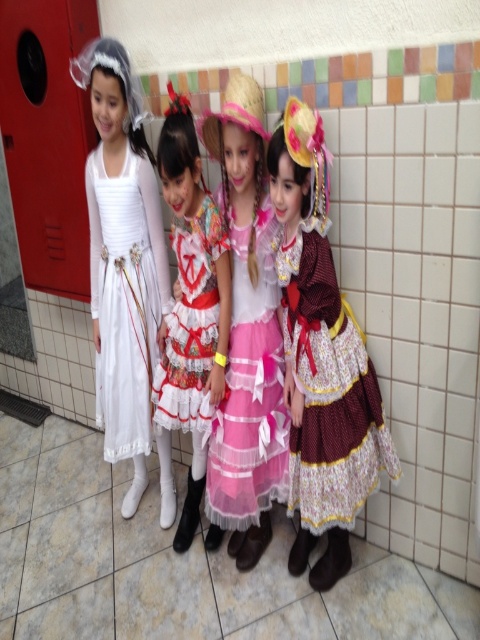
Question: Among these points, which one is farthest from the camera?

Choices:
 (A) (182, 307)
 (B) (276, 310)
 (C) (315, 518)

Answer: (A)

Question: Which point is farther to the camera?

Choices:
 (A) white satin dress at left
 (B) floral lace dress at center

Answer: (A)

Question: Which object is farther from the camera taking this photo?

Choices:
 (A) white satin dress at left
 (B) maroon satin dress at right
 (C) pink tulle dress at center
 (D) floral lace dress at center

Answer: (A)

Question: Is white satin dress at left closer to the viewer compared to floral lace dress at center?

Choices:
 (A) no
 (B) yes

Answer: (A)

Question: Can you confirm if pink tulle dress at center is wider than floral lace dress at center?

Choices:
 (A) yes
 (B) no

Answer: (B)

Question: Is maroon satin dress at right below pink tulle dress at center?

Choices:
 (A) no
 (B) yes

Answer: (B)